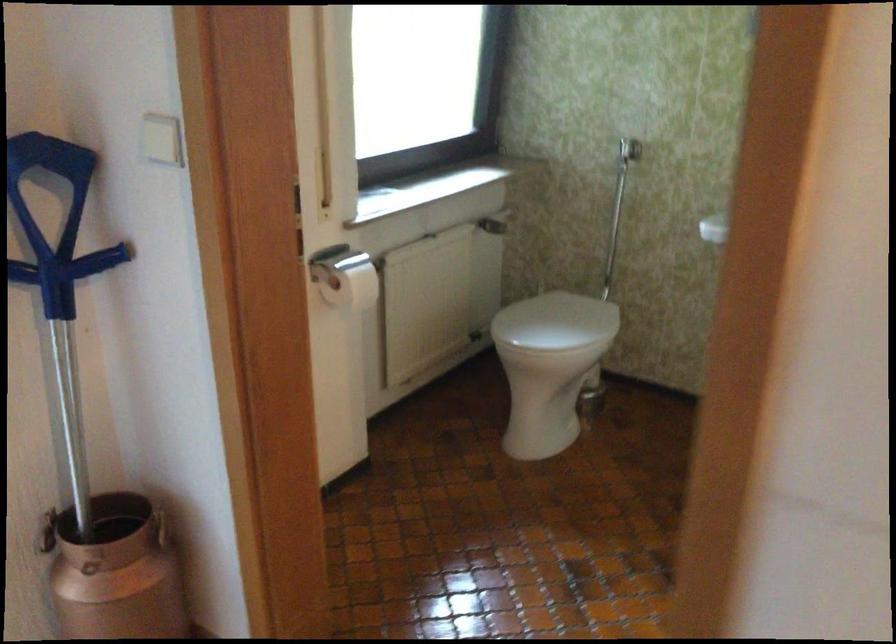
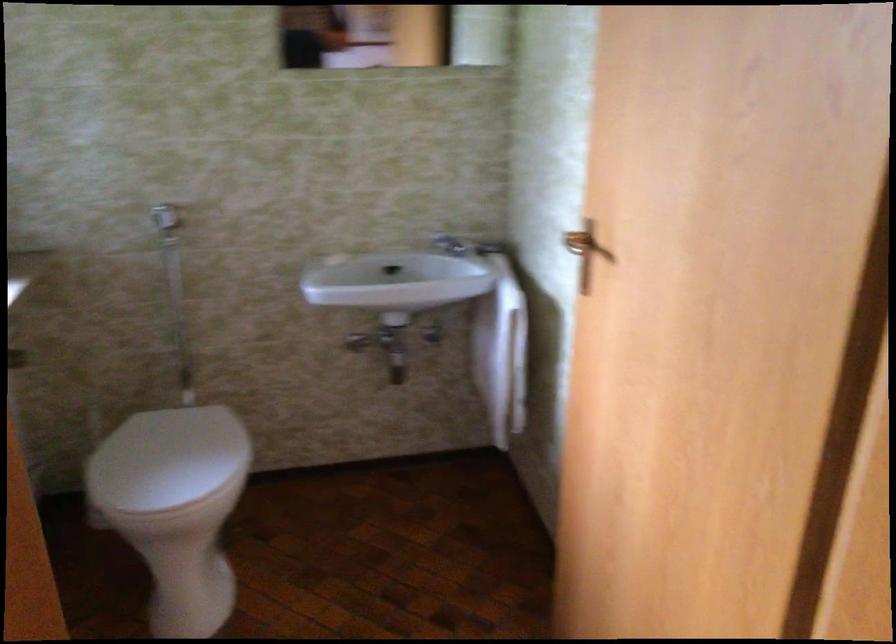
In the second image, find the point that corresponds to (547,317) in the first image.

(167, 460)